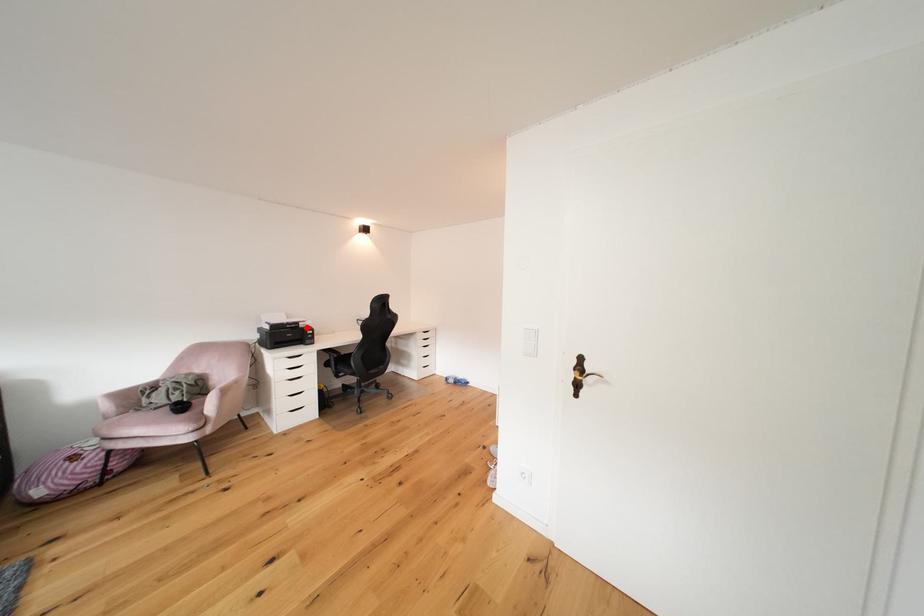
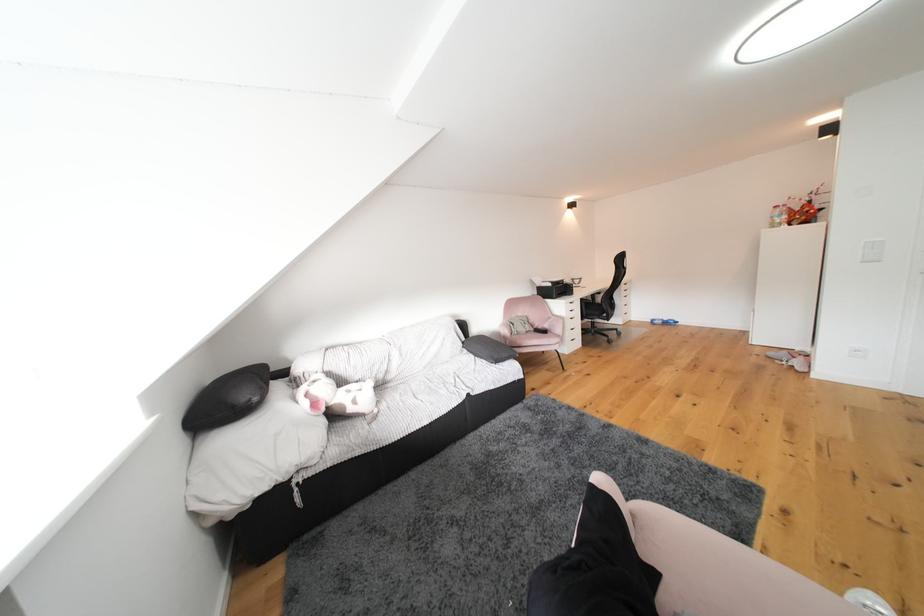
Question: I am providing you with two images of the same scene from different viewpoints. A red point is marked on the first image. Can you still see the location of the red point in image 2?

Choices:
 (A) Yes
 (B) No

Answer: (A)